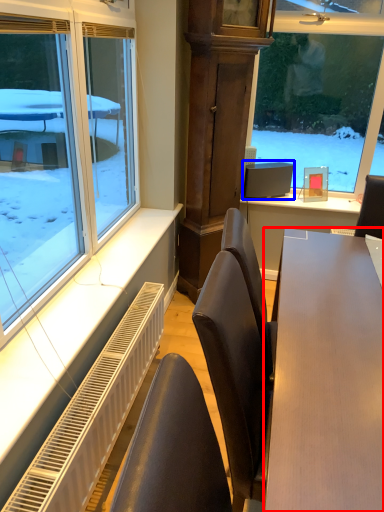
Question: Among these objects, which one is nearest to the camera, table (highlighted by a red box) or computer monitor (highlighted by a blue box)?

Choices:
 (A) table
 (B) computer monitor

Answer: (A)